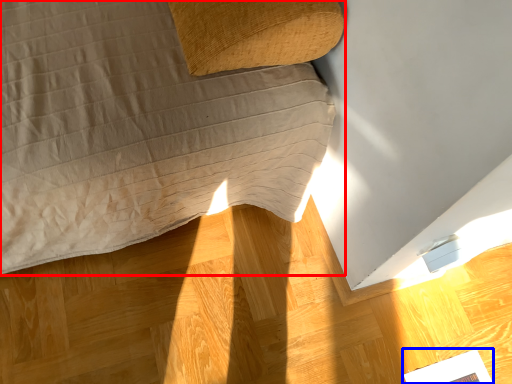
Question: Which point is further to the camera, furniture (highlighted by a red box) or magazine (highlighted by a blue box)?

Choices:
 (A) furniture
 (B) magazine

Answer: (B)